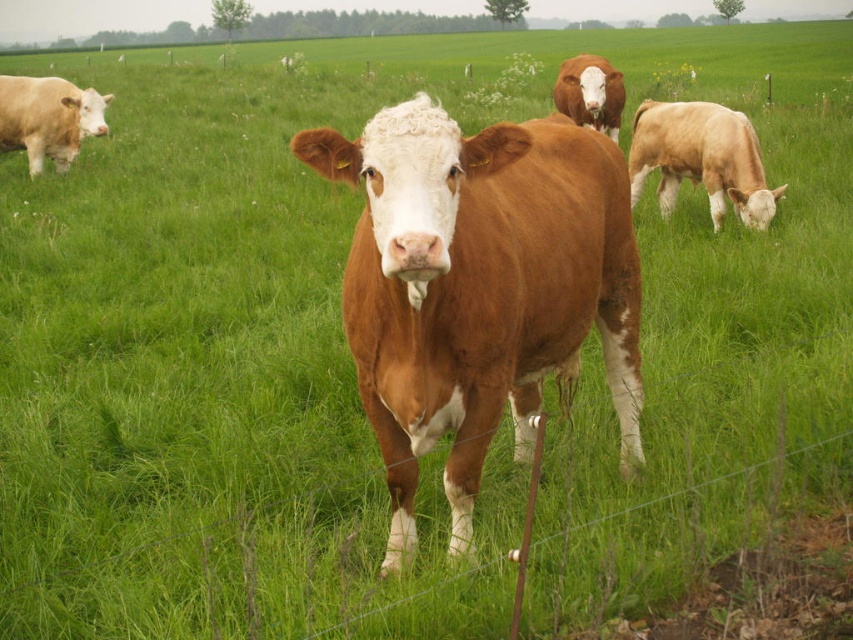
You are a farmer checking the field. You notice the light brown smooth cow at right and the matte white cow at left. Which cow is nearer to you?

The light brown smooth cow at right is closer to the viewer than the matte white cow at left.

You are a farmer checking the size of your cows. You have a fence that can only hold cows smaller than the brown smooth cow at center. Can the matte white cow at left fit through the fence?

The brown smooth cow at center is bigger than the matte white cow at left, so the matte white cow at left is smaller and can fit through the fence.